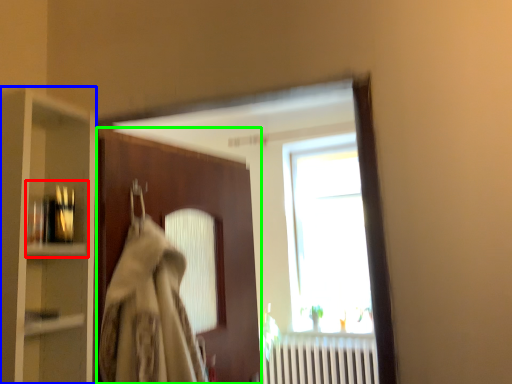
Question: Estimate the real-world distances between objects in this image. Which object is closer to shelf (highlighted by a red box), cabinetry (highlighted by a blue box) or door (highlighted by a green box)?

Choices:
 (A) cabinetry
 (B) door

Answer: (A)